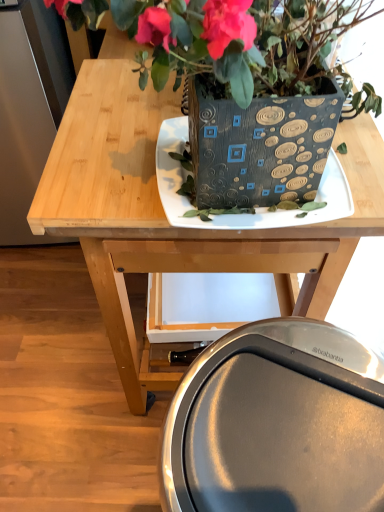
Question: Is there a large distance between matte black plate at center and wooden table at center?

Choices:
 (A) yes
 (B) no

Answer: (B)

Question: From the image's perspective, is matte black plate at center beneath wooden table at center?

Choices:
 (A) yes
 (B) no

Answer: (A)

Question: Is matte black plate at center further to camera compared to wooden table at center?

Choices:
 (A) no
 (B) yes

Answer: (A)

Question: Does matte black plate at center appear on the right side of wooden table at center?

Choices:
 (A) no
 (B) yes

Answer: (B)

Question: Can you confirm if matte black plate at center is thinner than wooden table at center?

Choices:
 (A) yes
 (B) no

Answer: (A)

Question: Could you tell me if matte black plate at center is turned towards wooden table at center?

Choices:
 (A) no
 (B) yes

Answer: (B)

Question: Is wooden table at center at the left side of metallic silver swivel chair at lower center?

Choices:
 (A) yes
 (B) no

Answer: (A)

Question: Is wooden table at center closer to camera compared to metallic silver swivel chair at lower center?

Choices:
 (A) no
 (B) yes

Answer: (A)

Question: Is wooden table at center not within metallic silver swivel chair at lower center?

Choices:
 (A) no
 (B) yes

Answer: (B)

Question: Is wooden table at center beside metallic silver swivel chair at lower center?

Choices:
 (A) yes
 (B) no

Answer: (B)

Question: Does wooden table at center have a greater height compared to metallic silver swivel chair at lower center?

Choices:
 (A) no
 (B) yes

Answer: (B)

Question: Is wooden table at center far from metallic silver swivel chair at lower center?

Choices:
 (A) yes
 (B) no

Answer: (B)

Question: Is matte black plate at center next to metallic silver swivel chair at lower center and touching it?

Choices:
 (A) yes
 (B) no

Answer: (B)